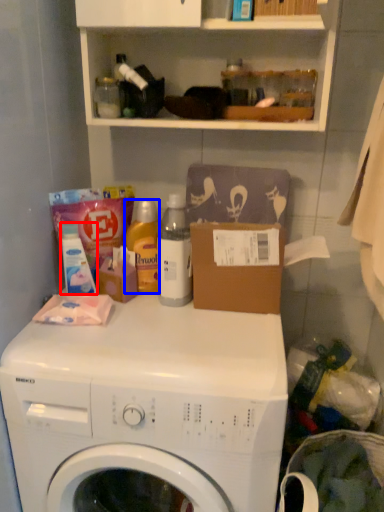
Question: Which object appears closest to the camera in this image, toiletry (highlighted by a red box) or cleaning product (highlighted by a blue box)?

Choices:
 (A) toiletry
 (B) cleaning product

Answer: (A)